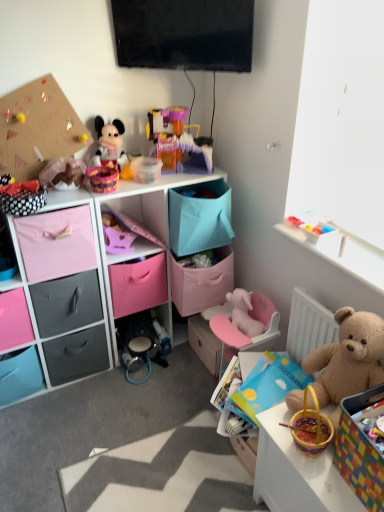
At what (x,y) coordinates should I click in order to perform the action: click on free location above pink fabric drawer at left, which appears as the fifth drawer when viewed from the left (from a real-world perspective). Please return your answer as a coordinate pair (x, y). This screenshot has width=384, height=512. Looking at the image, I should click on (52, 205).